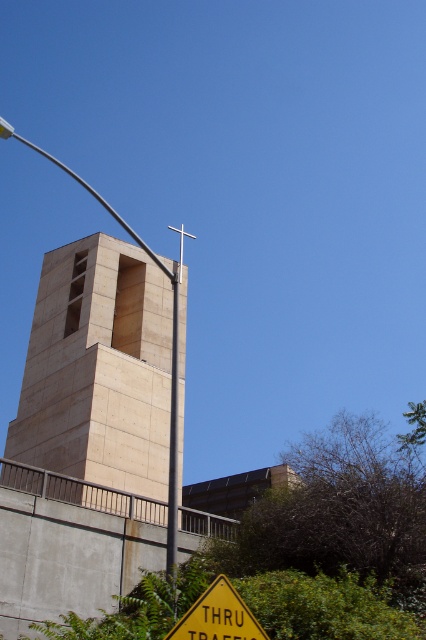
You are a city planner reviewing this image to ensure compliance with zoning laws. The zoning law states that no structure can occupy more space than the designated landmark. If the beige stone bell tower at center is the designated landmark, does the metallic gray pole at center comply with the zoning law?

The beige stone bell tower at center occupies less space than the metallic gray pole at center. Since the bell tower is the designated landmark, the pole exceeds the allowed space and thus does not comply with the zoning law.

You are a city planner evaluating the placement of a new 100m tall skyscraper. The beige stone bell tower at center and metallic gray pole at center are both in the proposed construction area. Which existing structure is shorter and must be considered for potential obstruction of the skyscraper?

The beige stone bell tower at center is shorter than the metallic gray pole at center, so it must be considered for potential obstruction of the skyscraper.